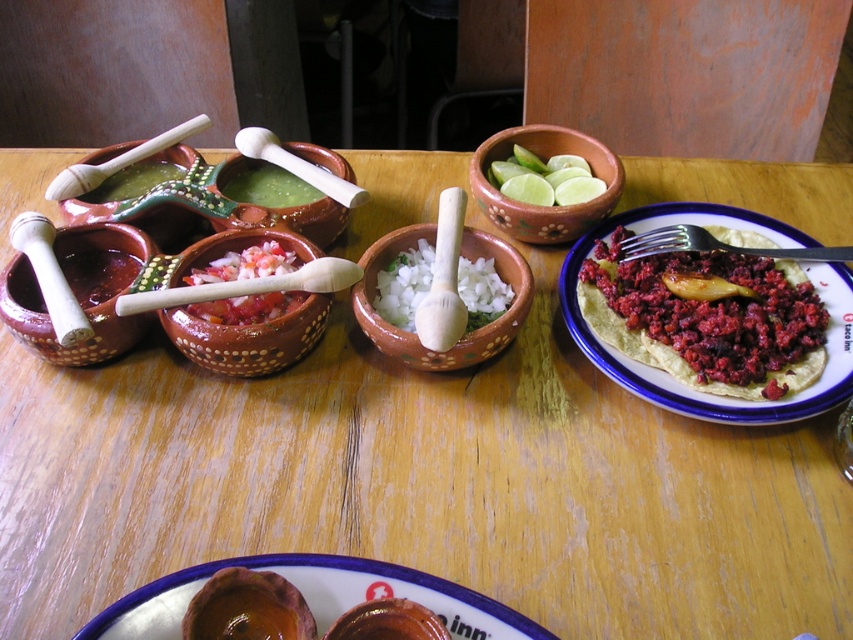
Question: Which point is farther from the camera taking this photo?

Choices:
 (A) (283, 307)
 (B) (155, 140)

Answer: (B)

Question: Is green lime at center bigger than white wood pestle at center?

Choices:
 (A) yes
 (B) no

Answer: (B)

Question: Is white ceramic bowl at center wider than shiny brown bowl at center?

Choices:
 (A) no
 (B) yes

Answer: (B)

Question: Does matte brown bowl at lower center appear on the right side of green lime at center?

Choices:
 (A) no
 (B) yes

Answer: (A)

Question: Which object is positioned farthest from the brown clay bowl at center?

Choices:
 (A) wooden pestle at center
 (B) matte clay bowl at center

Answer: (B)

Question: Which point is farther to the camera?

Choices:
 (A) (538, 198)
 (B) (169, 298)
 (C) (70, 195)

Answer: (A)